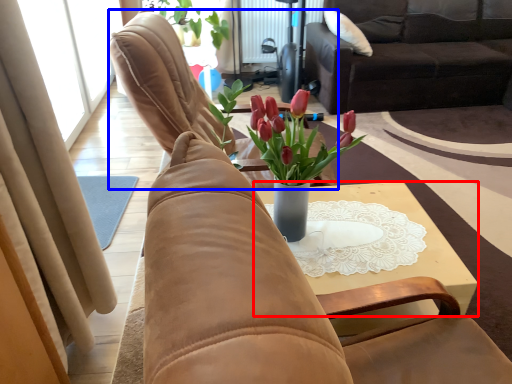
Question: Which of the following is the farthest to the observer, table (highlighted by a red box) or chair (highlighted by a blue box)?

Choices:
 (A) table
 (B) chair

Answer: (B)